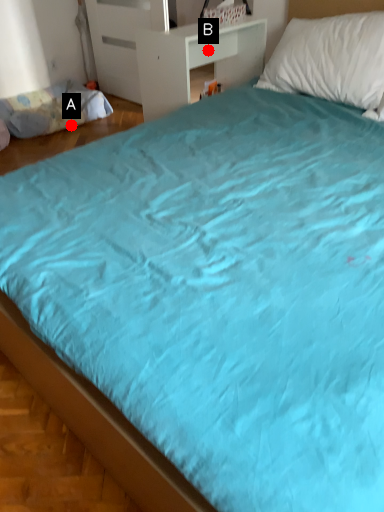
Question: Two points are circled on the image, labeled by A and B beside each circle. Which point is closer to the camera taking this photo?

Choices:
 (A) A is closer
 (B) B is closer

Answer: (B)